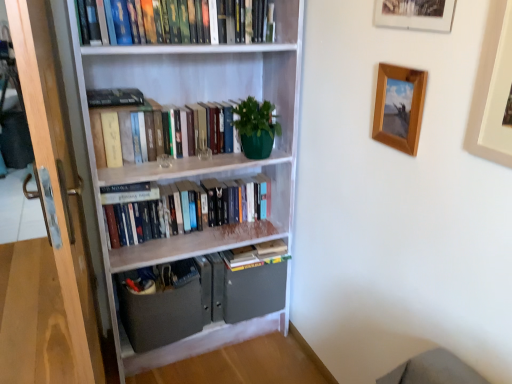
Where is `empty space that is ontop of matte gray cabinet at lower center (from a real-world perspective)`? This screenshot has height=384, width=512. empty space that is ontop of matte gray cabinet at lower center (from a real-world perspective) is located at coordinates (163, 277).